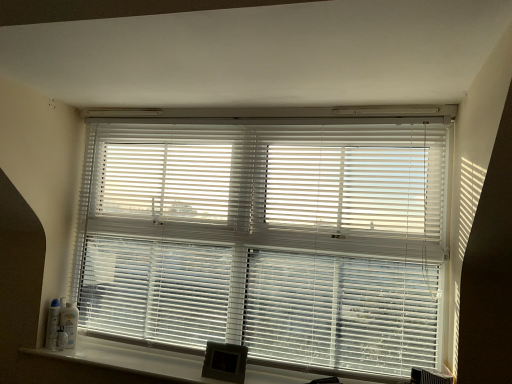
Describe the element at coordinates (267, 238) in the screenshot. Image resolution: width=512 pixels, height=384 pixels. I see `white plastic blinds at center` at that location.

Find the location of a particular element. The image size is (512, 384). white plastic blinds at center is located at coordinates click(267, 238).

Identify the location of white smooth window sill at lower center. This screenshot has height=384, width=512. (132, 359).

Describe the element at coordinates (132, 359) in the screenshot. I see `white smooth window sill at lower center` at that location.

You are a GUI agent. You are given a task and a screenshot of the screen. Output one action in this format:
    pyautogui.click(x=<x>, y=<y>)
    Task: Click on the white plastic blinds at center
    The image size is (512, 384).
    Given the screenshot: What is the action you would take?
    pyautogui.click(x=267, y=238)

In the scene shown: Considering the relative positions of white smooth window sill at lower center and white plastic blinds at center in the image provided, is white smooth window sill at lower center to the right of white plastic blinds at center from the viewer's perspective?

No, white smooth window sill at lower center is not to the right of white plastic blinds at center.

Consider the image. Which object is closer to the camera, white smooth window sill at lower center or white plastic blinds at center?

white smooth window sill at lower center.

Which point is more forward, (121, 367) or (181, 181)?

Point (121, 367)

Based on the photo, from the image's perspective, which object appears higher, white smooth window sill at lower center or white plastic blinds at center?

white plastic blinds at center.

From a real-world perspective, which is physically above, white smooth window sill at lower center or white plastic blinds at center?

white plastic blinds at center is physically above.

Considering the relative sizes of white smooth window sill at lower center and white plastic blinds at center in the image provided, is white smooth window sill at lower center thinner than white plastic blinds at center?

In fact, white smooth window sill at lower center might be wider than white plastic blinds at center.

Is white smooth window sill at lower center taller or shorter than white plastic blinds at center?

Considering their sizes, white smooth window sill at lower center has less height than white plastic blinds at center.

Can you confirm if white smooth window sill at lower center is bigger than white plastic blinds at center?

Incorrect, white smooth window sill at lower center is not larger than white plastic blinds at center.

Is white plastic blinds at center located within white smooth window sill at lower center?

No, white plastic blinds at center is located outside of white smooth window sill at lower center.

Is white smooth window sill at lower center in contact with white plastic blinds at center?

white smooth window sill at lower center and white plastic blinds at center are not in contact.

Is white smooth window sill at lower center turned away from white plastic blinds at center?

No, white smooth window sill at lower center's orientation is not away from white plastic blinds at center.

Can you tell me how much white smooth window sill at lower center and white plastic blinds at center differ in facing direction?

0.957 degrees.

Identify the location of window blind behind the white smooth window sill at lower center. The width and height of the screenshot is (512, 384). (267, 238).

Is white plastic blinds at center to the left or to the right of white smooth window sill at lower center in the image?

Clearly, white plastic blinds at center is on the right of white smooth window sill at lower center in the image.

Which is behind, white plastic blinds at center or white smooth window sill at lower center?

white plastic blinds at center is behind.

Does point (158, 176) lie in front of point (97, 359)?

No, (158, 176) is further to viewer.

From the picture: From the image's perspective, is white plastic blinds at center below white smooth window sill at lower center?

Incorrect, from the image's perspective, white plastic blinds at center is higher than white smooth window sill at lower center.

From the picture: From a real-world perspective, is white plastic blinds at center physically below white smooth window sill at lower center?

Incorrect, from a real-world perspective, white plastic blinds at center is higher than white smooth window sill at lower center.

Considering the sizes of objects white plastic blinds at center and white smooth window sill at lower center in the image provided, who is wider, white plastic blinds at center or white smooth window sill at lower center?

white smooth window sill at lower center is wider.

Considering the sizes of white plastic blinds at center and white smooth window sill at lower center in the image, is white plastic blinds at center taller or shorter than white smooth window sill at lower center?

white plastic blinds at center is taller than white smooth window sill at lower center.

Considering the sizes of objects white plastic blinds at center and white smooth window sill at lower center in the image provided, who is smaller, white plastic blinds at center or white smooth window sill at lower center?

white smooth window sill at lower center.

Could white smooth window sill at lower center be considered to be inside white plastic blinds at center?

No.

Is white plastic blinds at center far from white smooth window sill at lower center?

No, white plastic blinds at center is not far from white smooth window sill at lower center.

Is white plastic blinds at center facing towards white smooth window sill at lower center?

No, white plastic blinds at center is not aimed at white smooth window sill at lower center.

How different are the orientations of white plastic blinds at center and white smooth window sill at lower center in degrees?

0.957 degrees separate the facing orientations of white plastic blinds at center and white smooth window sill at lower center.

Measure the distance between white plastic blinds at center and white smooth window sill at lower center.

A distance of 44.11 centimeters exists between white plastic blinds at center and white smooth window sill at lower center.

Identify the location of window blind above the white smooth window sill at lower center (from a real-world perspective). (267, 238).

Identify the location of window sill in front of the white plastic blinds at center. (132, 359).

Where is `window sill that appears on the left of white plastic blinds at center`? This screenshot has width=512, height=384. window sill that appears on the left of white plastic blinds at center is located at coordinates (132, 359).